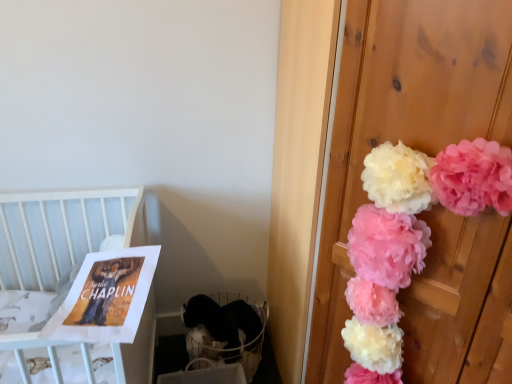
You are a GUI agent. You are given a task and a screenshot of the screen. Output one action in this format:
    pyautogui.click(x=<x>, y=<y>)
    Task: Click on the vacant space situated above matte paper poster at left (from a real-world perspective)
    
    Given the screenshot: What is the action you would take?
    pyautogui.click(x=124, y=272)